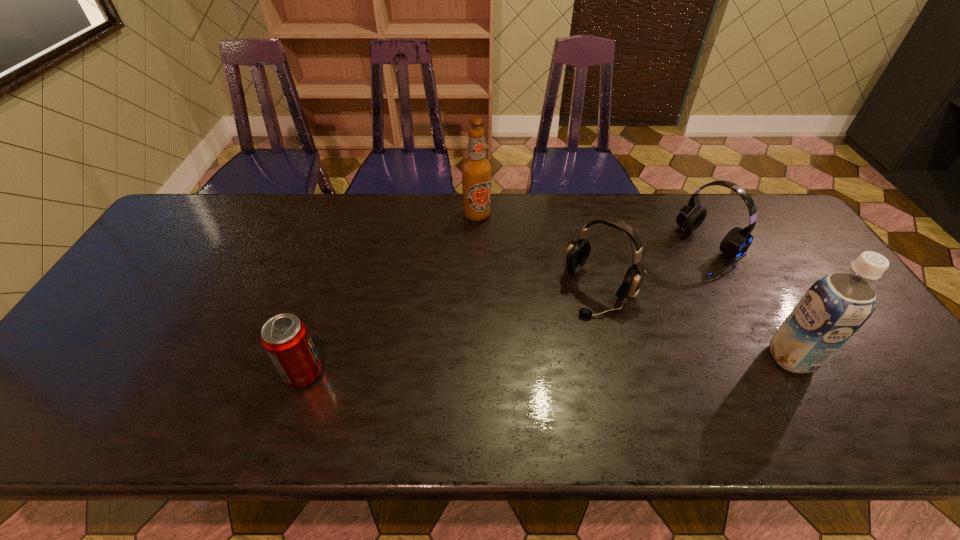
The height and width of the screenshot is (540, 960). In order to click on vacant space located on the ear cushions of the right headset in this screenshot , I will do `click(630, 315)`.

This screenshot has width=960, height=540. In order to click on vacant area located on the ear cushions of the right headset in this screenshot , I will do `click(677, 282)`.

Where is `free space located on the ear cushions of the right headset`? free space located on the ear cushions of the right headset is located at coordinates (663, 292).

This screenshot has height=540, width=960. I want to click on vacant space located on the front label of the second object from left to right, so click(486, 244).

Find the location of a particular element. free region located 0.280m on the front label of the second object from left to right is located at coordinates (498, 286).

Where is `free location located on the front label of the second object from left to right`? This screenshot has width=960, height=540. free location located on the front label of the second object from left to right is located at coordinates (508, 316).

The height and width of the screenshot is (540, 960). Identify the location of free space located 0.230m with the microphone on the side of the left headset. (535, 374).

What are the coordinates of `vacant space located with the microphone on the side of the left headset` in the screenshot? It's located at coord(543,362).

You are a GUI agent. You are given a task and a screenshot of the screen. Output one action in this format:
    pyautogui.click(x=<x>, y=<y>)
    Task: Click on the vacant area located 0.250m with the microphone on the side of the left headset
    
    Given the screenshot: What is the action you would take?
    pyautogui.click(x=530, y=380)

Identify the location of headset that is at the far edge. (737, 241).